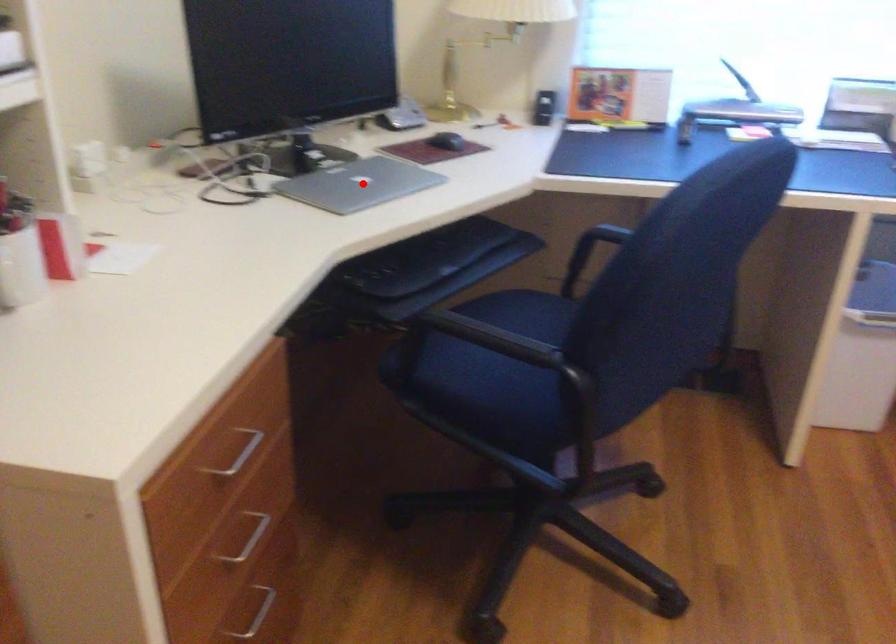
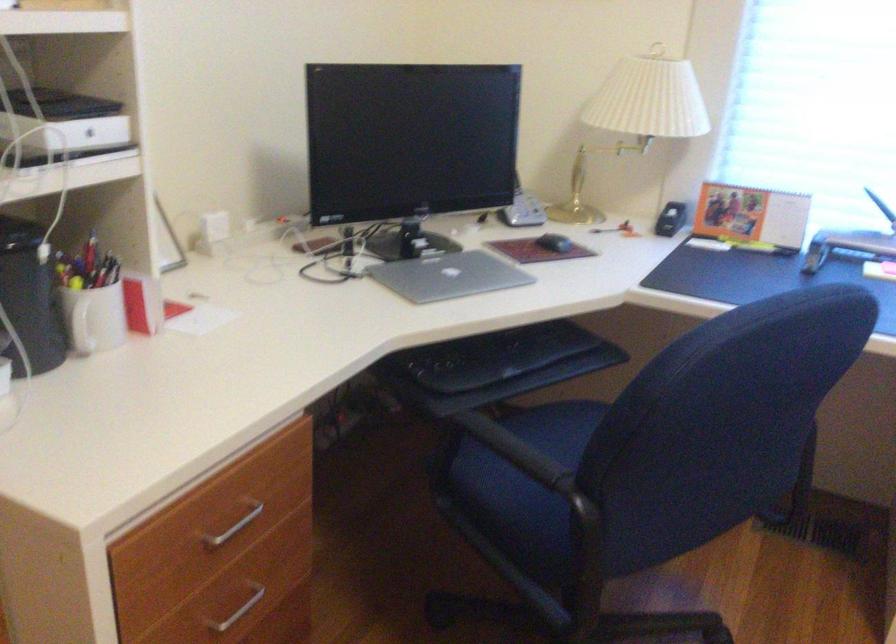
Question: I am providing you with two images of the same scene from different viewpoints. A red point is marked on the first image. Can you still see the location of the red point in image 2?

Choices:
 (A) Yes
 (B) No

Answer: (A)